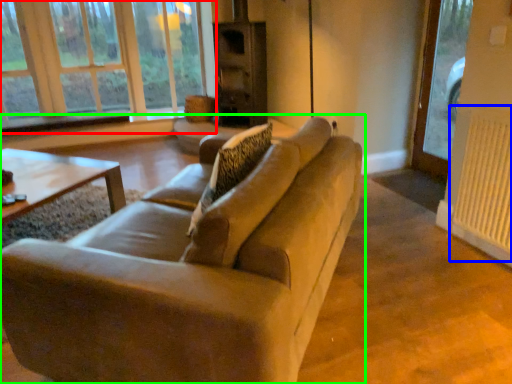
Question: Considering the real-world distances, which object is farthest from window (highlighted by a red box)? radiator (highlighted by a blue box) or studio couch (highlighted by a green box)?

Choices:
 (A) radiator
 (B) studio couch

Answer: (A)